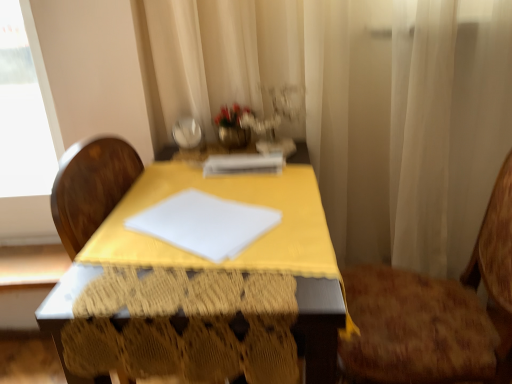
I want to click on vacant area that lies to the right of white paper at center, so click(x=297, y=167).